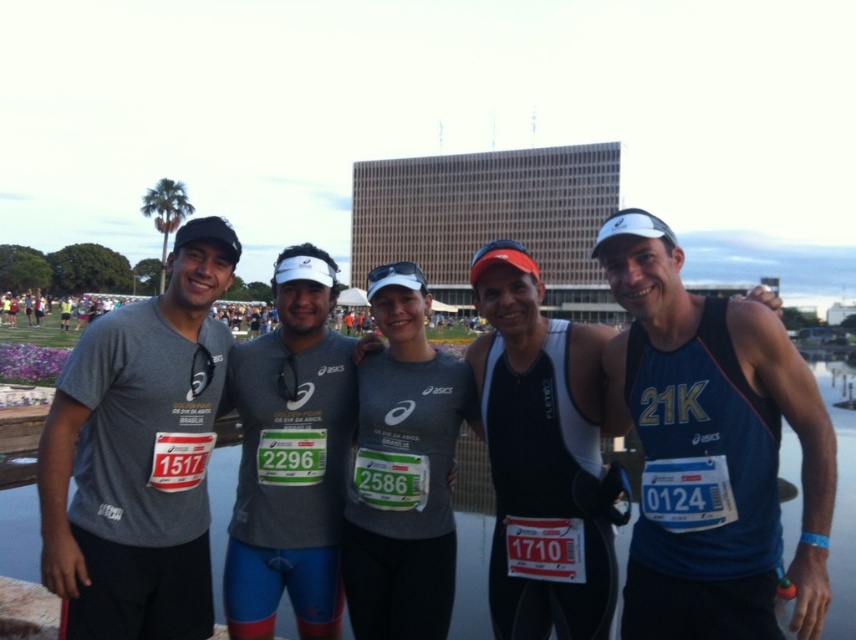
You are a photographer trying to capture a closeup of the black matte tank top at center and the gray fabric shirt at center. Which one should you focus on first if you want to ensure both are in focus without moving the camera?

The black matte tank top at center is located above the gray fabric shirt at center. Since they are at different heights, you should focus on the black matte tank top at center first as it is closer to the camera, ensuring depth of field captures both.